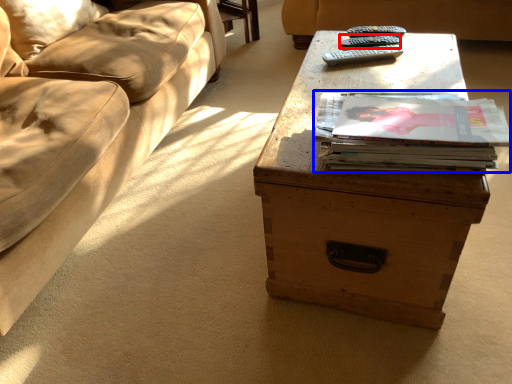
Question: Which object is closer to the camera taking this photo, remote (highlighted by a red box) or paperback book (highlighted by a blue box)?

Choices:
 (A) remote
 (B) paperback book

Answer: (B)